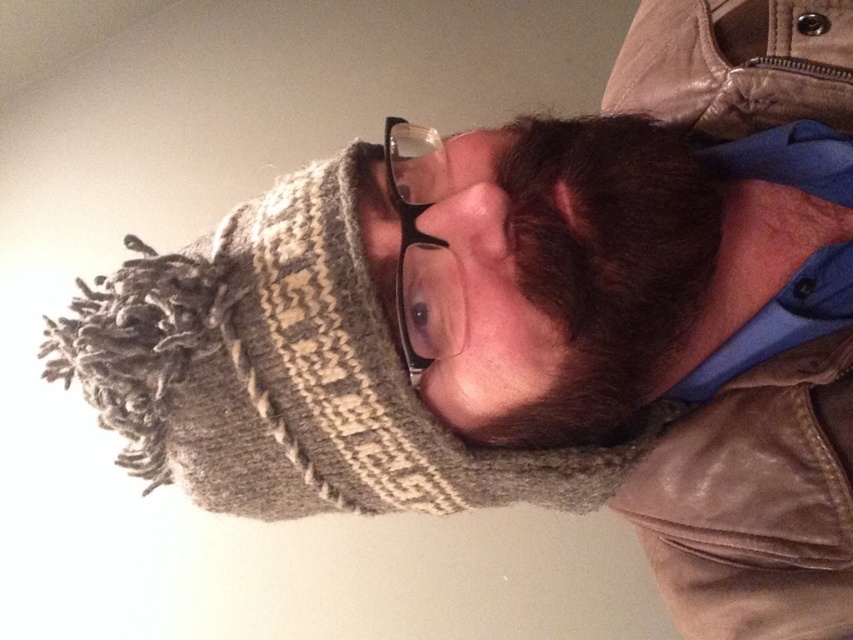
You are taking a photo of a person wearing a knitted hat and glasses. You notice two points in the image at coordinates point (x=753, y=586) and point (x=608, y=214). Which point is closer to the camera?

Point (x=608, y=214) is closer to the camera than point (x=753, y=586) because the description states that point (x=753, y=586) is further away.

Where is the leather jacket at right located in the image?

The leather jacket at right is located at point [755,502].

You are a photographer setting up a portrait session. The subject is wearing a leather jacket at right and has a dark brown fuzzy beard at center. You want to ensure that both the jacket and the beard are in focus. Given that your camera has a depth of field of 4 inches, will both elements be in focus?

The leather jacket at right is 4.46 inches away from the dark brown fuzzy beard at center. Since the distance between them exceeds the camera depth of field of 4 inches, both elements may not be in focus simultaneously.